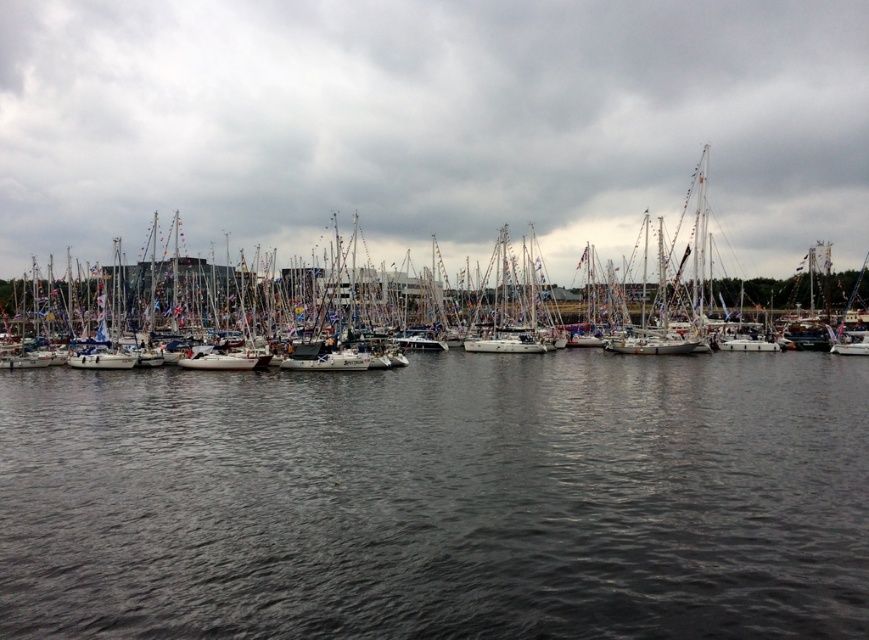
Is white matte boats at center behind white matte sailboat at center?

Yes, white matte boats at center is behind white matte sailboat at center.

What do you see at coordinates (432, 124) in the screenshot? I see `white matte boats at center` at bounding box center [432, 124].

This screenshot has height=640, width=869. Describe the element at coordinates (432, 124) in the screenshot. I see `white matte boats at center` at that location.

Locate an element on the screen. The image size is (869, 640). white matte boats at center is located at coordinates (432, 124).

Is dark gray water at center further to the viewer compared to white matte boats at center?

No, it is not.

Is point (64, 467) in front of point (308, 92)?

Yes, point (64, 467) is closer to viewer.

I want to click on dark gray water at center, so click(x=440, y=499).

Does dark gray water at center have a smaller size compared to white matte sailboat at center?

Yes.

From the picture: Between dark gray water at center and white matte sailboat at center, which one is positioned higher?

white matte sailboat at center

Is point (216, 426) less distant than point (804, 273)?

Yes, point (216, 426) is in front of point (804, 273).

Identify the location of dark gray water at center. (440, 499).